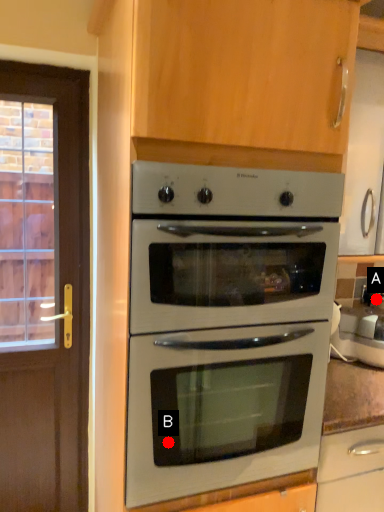
Question: Two points are circled on the image, labeled by A and B beside each circle. Which point is farther to the camera?

Choices:
 (A) A is further
 (B) B is further

Answer: (A)